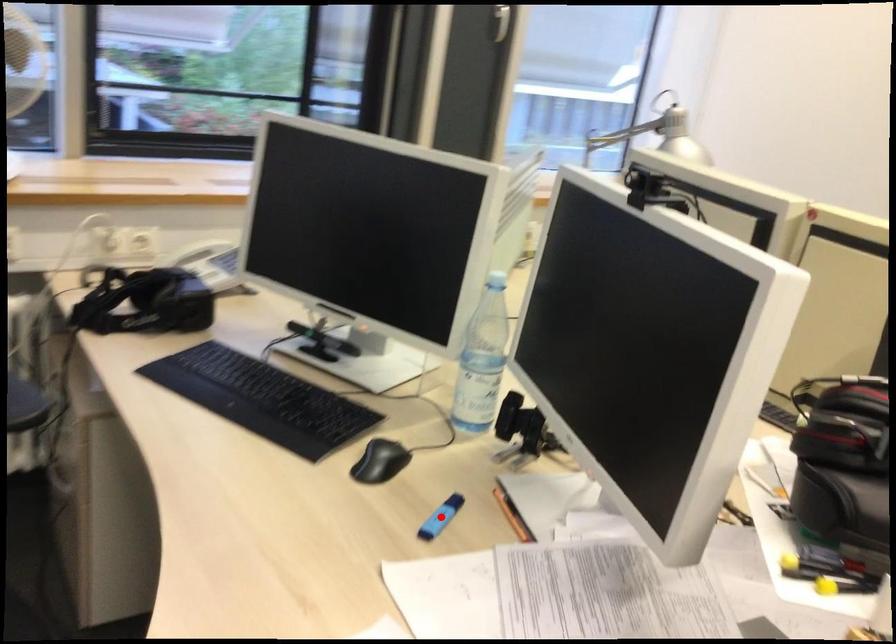
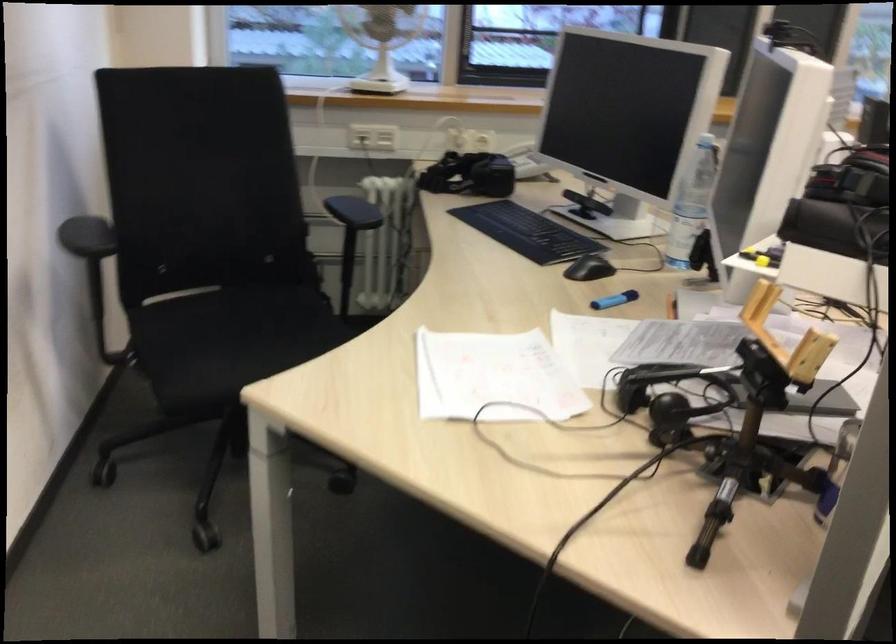
Find the pixel in the second image that matches the highlighted location in the first image.

(615, 299)